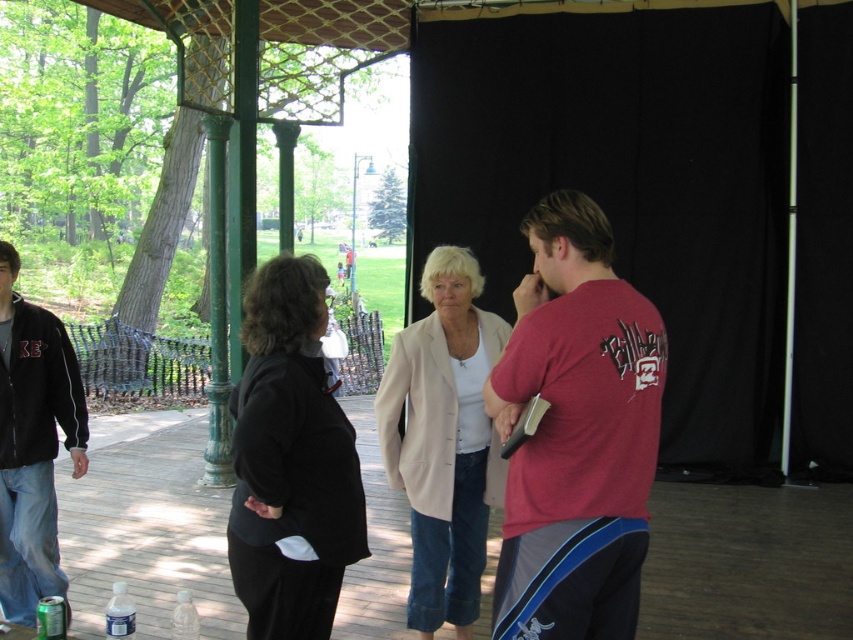
Which is below, light beige fabric jacket at center or black fleece jacket at left?

light beige fabric jacket at center is below.

Does point (438, 602) lie in front of point (3, 326)?

Yes, it is in front of point (3, 326).

Where is `light beige fabric jacket at center`? This screenshot has height=640, width=853. light beige fabric jacket at center is located at coordinates (444, 440).

You are a GUI agent. You are given a task and a screenshot of the screen. Output one action in this format:
    pyautogui.click(x=<x>, y=<y>)
    Task: Click on the light beige fabric jacket at center
    
    Given the screenshot: What is the action you would take?
    pyautogui.click(x=444, y=440)

Can you confirm if matte red t-shirt at right is positioned above black fleece jacket at left?

Correct, matte red t-shirt at right is located above black fleece jacket at left.

Who is more forward, (x=648, y=461) or (x=39, y=492)?

Point (x=648, y=461)

You are a GUI agent. You are given a task and a screenshot of the screen. Output one action in this format:
    pyautogui.click(x=<x>, y=<y>)
    Task: Click on the matte red t-shirt at right
    
    Given the screenshot: What is the action you would take?
    pyautogui.click(x=576, y=433)

Who is shorter, matte red t-shirt at right or light beige fabric jacket at center?

matte red t-shirt at right is shorter.

Can you confirm if matte red t-shirt at right is bigger than light beige fabric jacket at center?

Actually, matte red t-shirt at right might be smaller than light beige fabric jacket at center.

The height and width of the screenshot is (640, 853). I want to click on matte red t-shirt at right, so click(x=576, y=433).